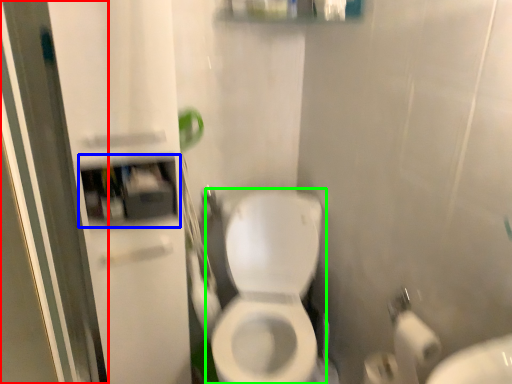
Question: Estimate the real-world distances between objects in this image. Which object is farther from screen door (highlighted by a red box), medicine cabinet (highlighted by a blue box) or toilet (highlighted by a green box)?

Choices:
 (A) medicine cabinet
 (B) toilet

Answer: (B)